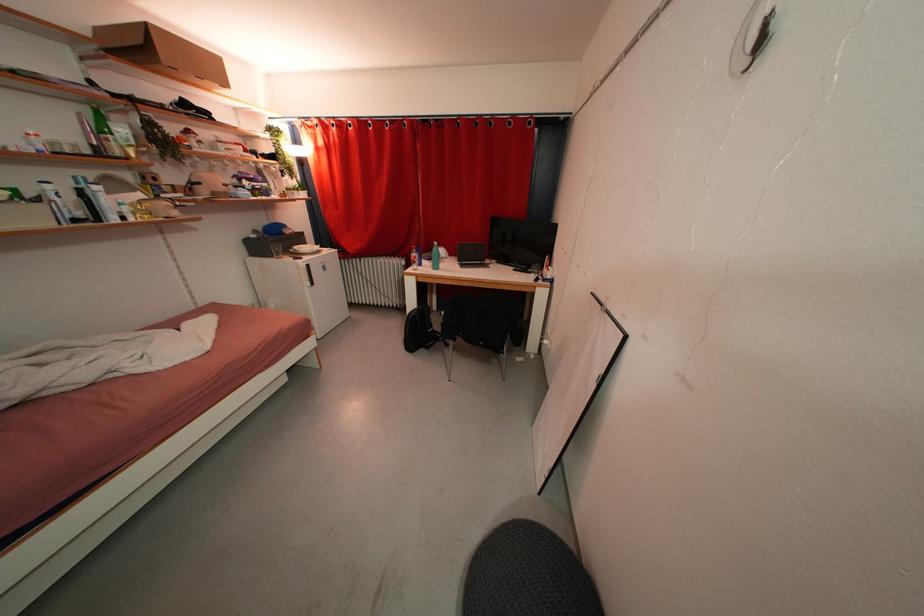
Locate an element on the screen. refrigerator handle is located at coordinates (306, 275).